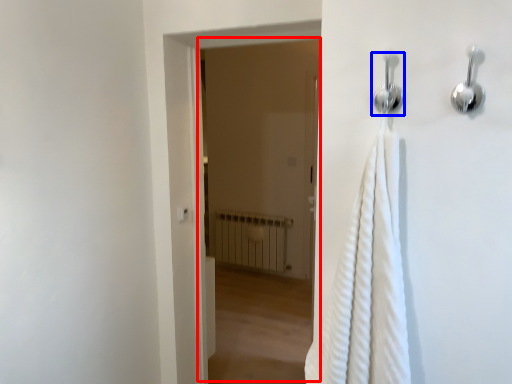
Question: Which object is further to the camera taking this photo, screen door (highlighted by a red box) or shower (highlighted by a blue box)?

Choices:
 (A) screen door
 (B) shower

Answer: (A)